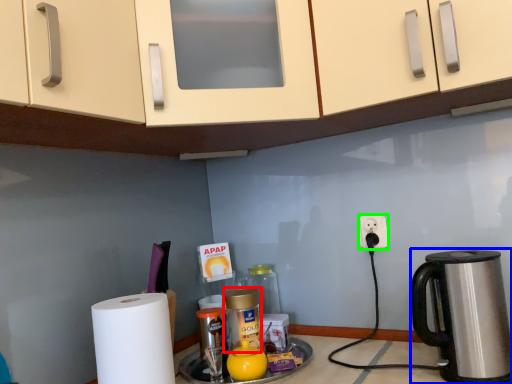
Question: Which is farther away from bottle (highlighted by a red box)? coffeepot (highlighted by a blue box) or power outlet (highlighted by a green box)?

Choices:
 (A) coffeepot
 (B) power outlet

Answer: (A)